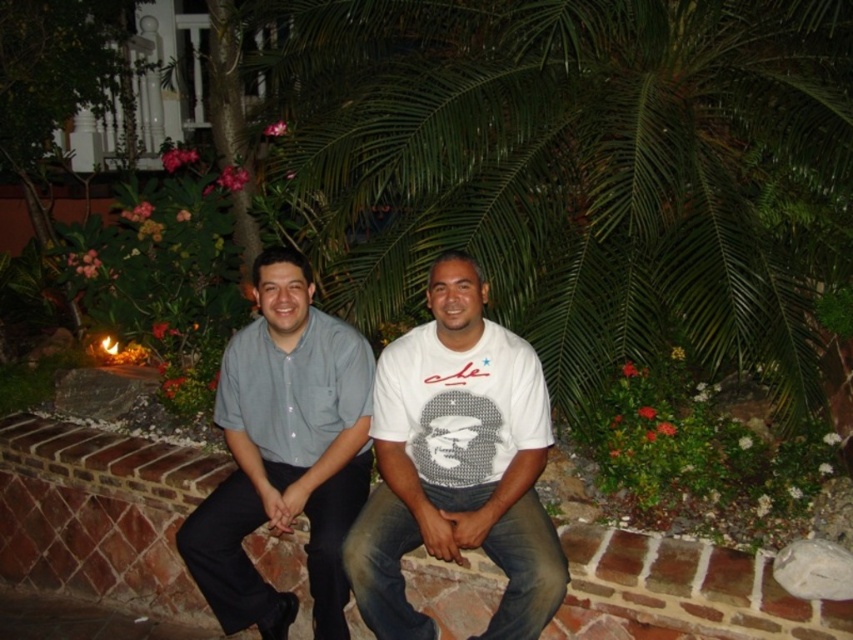
Does green leafy palm tree at center lie behind light blue cotton shirt at center?

Yes.

What do you see at coordinates (584, 168) in the screenshot?
I see `green leafy palm tree at center` at bounding box center [584, 168].

Between point (351, 0) and point (276, 397), which one is positioned behind?

The point (351, 0) is behind.

Locate an element on the screen. The width and height of the screenshot is (853, 640). green leafy palm tree at center is located at coordinates (584, 168).

Does white matte t-shirt at center have a greater width compared to light blue cotton shirt at center?

No.

Can you confirm if white matte t-shirt at center is positioned to the left of light blue cotton shirt at center?

No, white matte t-shirt at center is not to the left of light blue cotton shirt at center.

This screenshot has height=640, width=853. What do you see at coordinates (457, 465) in the screenshot? I see `white matte t-shirt at center` at bounding box center [457, 465].

Identify the location of white matte t-shirt at center. (457, 465).

Between green leafy palm tree at center and white matte t-shirt at center, which one is positioned lower?

white matte t-shirt at center

Does point (315, 17) come closer to viewer compared to point (437, 529)?

No, (315, 17) is further to viewer.

You are a GUI agent. You are given a task and a screenshot of the screen. Output one action in this format:
    pyautogui.click(x=<x>, y=<y>)
    Task: Click on the green leafy palm tree at center
    This screenshot has height=640, width=853.
    Given the screenshot: What is the action you would take?
    pyautogui.click(x=584, y=168)